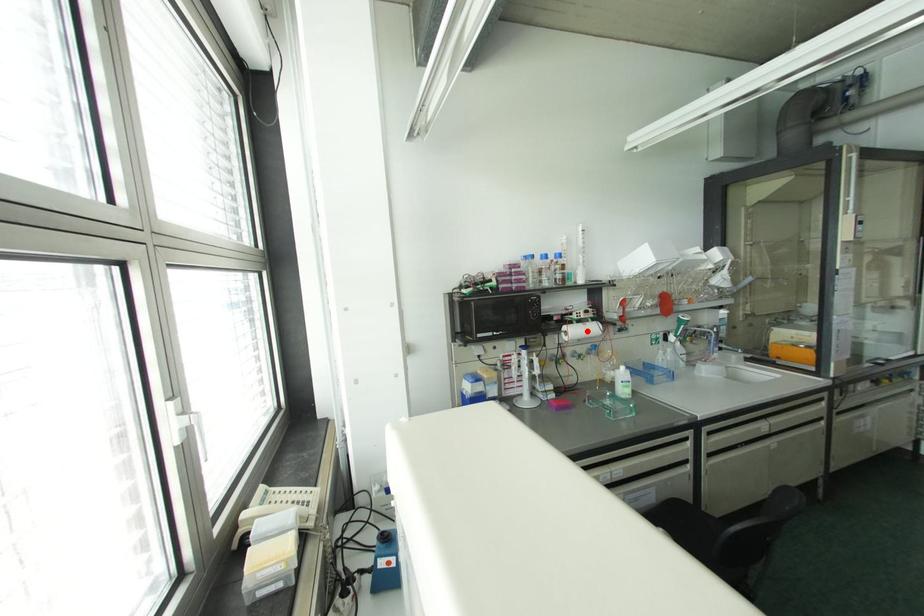
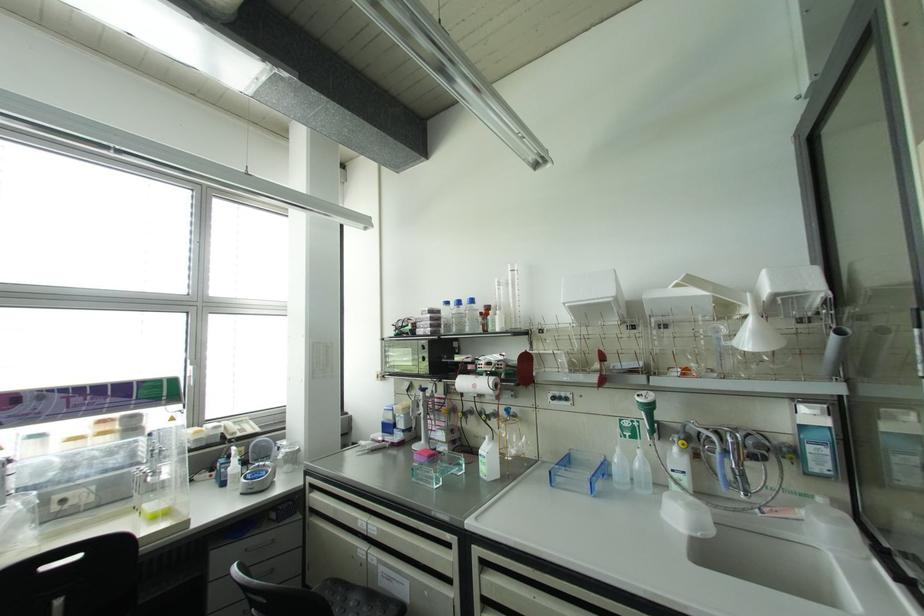
Locate, in the second image, the point that corresponds to the highlighted location in the first image.

(473, 386)